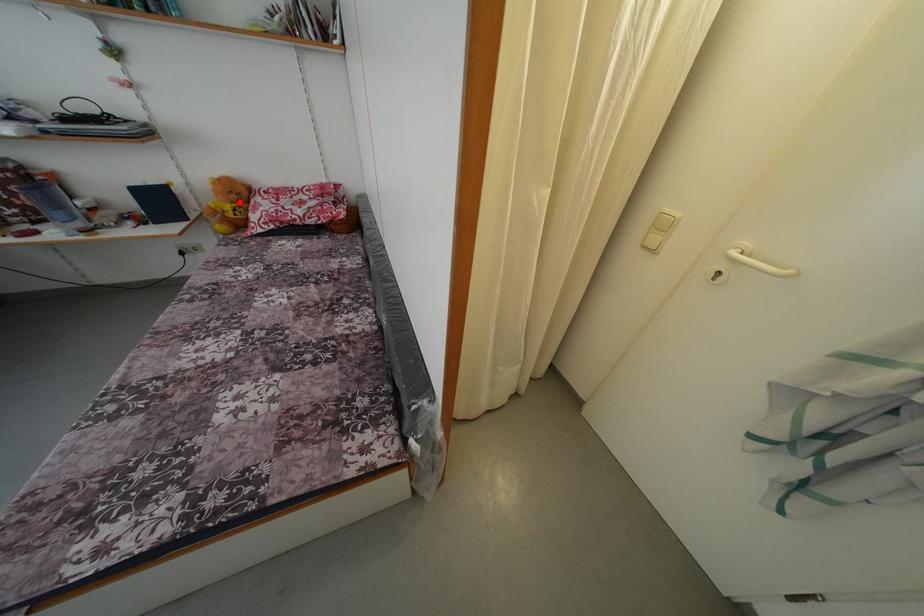
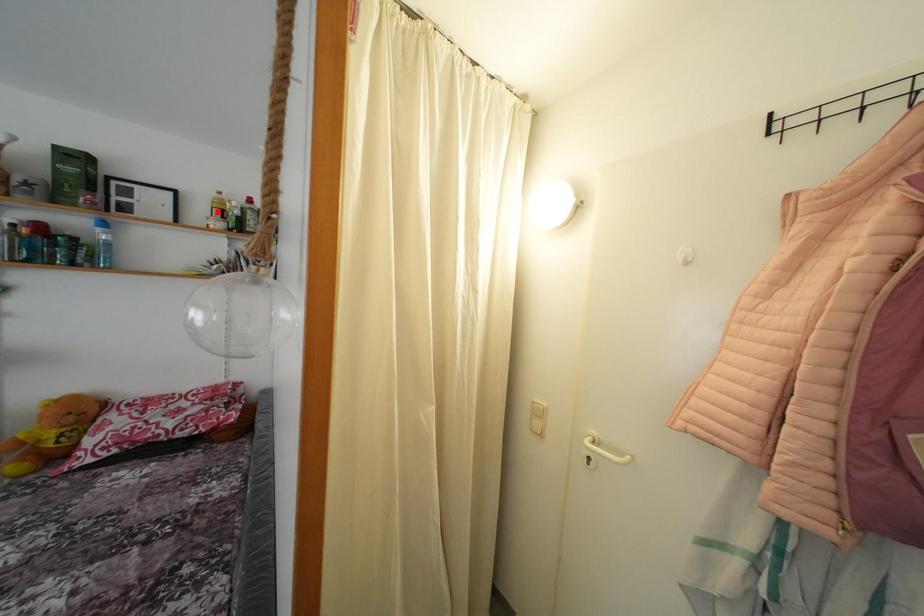
I am providing you with two images of the same scene from different viewpoints. A red point is marked on the first image and another point is marked on the second image. Is the marked point in image1 the same physical position as the marked point in image2?

No